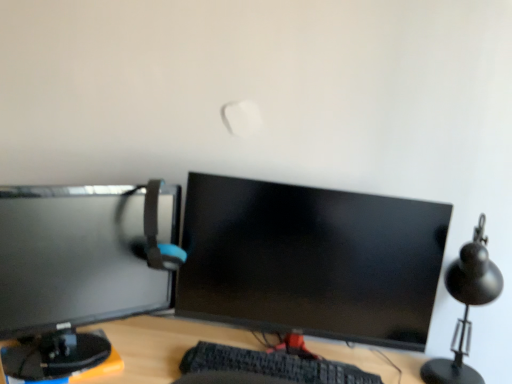
Question: From a real-world perspective, is matte gray computer chair at left physically below matte black monitor at left, arranged as the first computer monitor when viewed from the left?

Choices:
 (A) yes
 (B) no

Answer: (B)

Question: Is matte gray computer chair at left closer to camera compared to matte black monitor at left, the second computer monitor in the right-to-left sequence?

Choices:
 (A) yes
 (B) no

Answer: (B)

Question: Is matte gray computer chair at left not close to matte black monitor at left, arranged as the first computer monitor when viewed from the left?

Choices:
 (A) yes
 (B) no

Answer: (B)

Question: Is matte gray computer chair at left to the right of matte black monitor at left, the second computer monitor in the right-to-left sequence, from the viewer's perspective?

Choices:
 (A) no
 (B) yes

Answer: (B)

Question: Is matte gray computer chair at left oriented away from matte black monitor at left, the second computer monitor in the right-to-left sequence?

Choices:
 (A) no
 (B) yes

Answer: (B)

Question: Visually, is matte gray computer chair at left positioned to the left or to the right of matte black monitor at center, marked as the 1th computer monitor in a right-to-left arrangement?

Choices:
 (A) right
 (B) left

Answer: (B)

Question: In terms of size, does matte gray computer chair at left appear bigger or smaller than matte black monitor at center, marked as the 1th computer monitor in a right-to-left arrangement?

Choices:
 (A) small
 (B) big

Answer: (A)

Question: Is point (167, 243) positioned closer to the camera than point (359, 332)?

Choices:
 (A) farther
 (B) closer

Answer: (B)

Question: Considering the positions of matte gray computer chair at left and matte black monitor at center, the 2th computer monitor positioned from the left, in the image, is matte gray computer chair at left taller or shorter than matte black monitor at center, the 2th computer monitor positioned from the left,?

Choices:
 (A) short
 (B) tall

Answer: (A)

Question: From a real-world perspective, relative to black matte table lamp at right, is matte black monitor at left, arranged as the first computer monitor when viewed from the left, vertically above or below?

Choices:
 (A) above
 (B) below

Answer: (A)

Question: Is matte black monitor at left, arranged as the first computer monitor when viewed from the left, in front of or behind black matte table lamp at right in the image?

Choices:
 (A) behind
 (B) front

Answer: (B)

Question: Is point (150, 291) closer or farther from the camera than point (451, 349)?

Choices:
 (A) farther
 (B) closer

Answer: (B)

Question: From the image's perspective, is matte black monitor at left, arranged as the first computer monitor when viewed from the left, above or below black matte table lamp at right?

Choices:
 (A) below
 (B) above

Answer: (B)

Question: Considering the relative positions of black matte table lamp at right and matte black monitor at center, marked as the 1th computer monitor in a right-to-left arrangement, in the image provided, is black matte table lamp at right to the left or to the right of matte black monitor at center, marked as the 1th computer monitor in a right-to-left arrangement,?

Choices:
 (A) right
 (B) left

Answer: (A)

Question: From the image's perspective, relative to matte black monitor at center, the 2th computer monitor positioned from the left, is black matte table lamp at right above or below?

Choices:
 (A) above
 (B) below

Answer: (B)